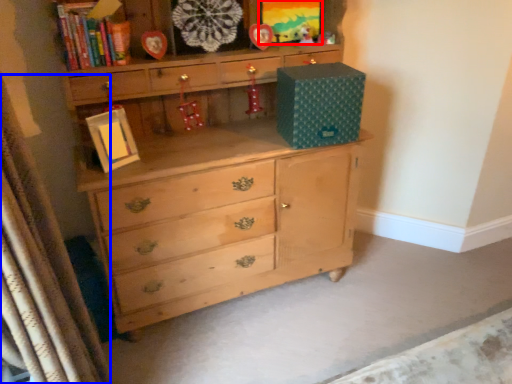
Question: Which object is closer to the camera taking this photo, picture frame (highlighted by a red box) or curtain (highlighted by a blue box)?

Choices:
 (A) picture frame
 (B) curtain

Answer: (B)